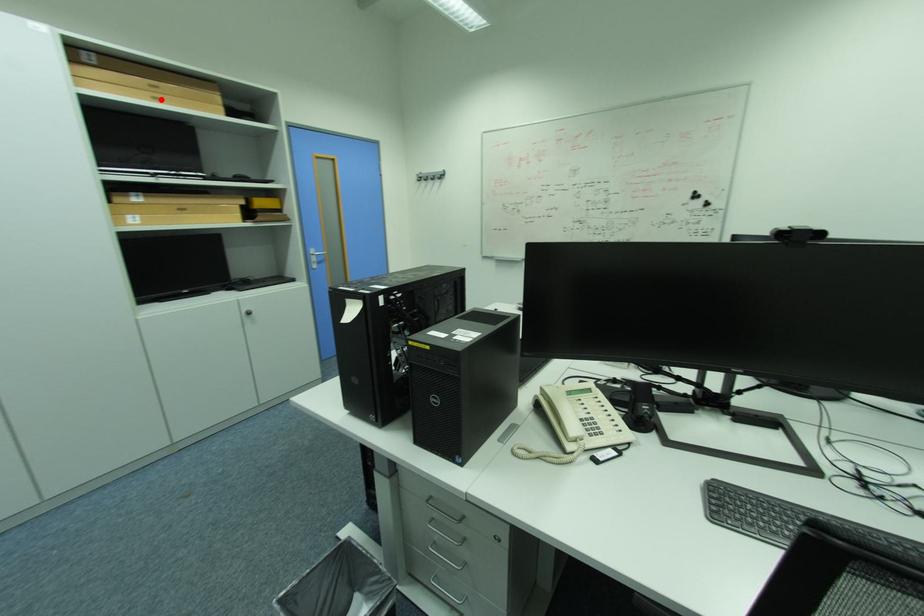
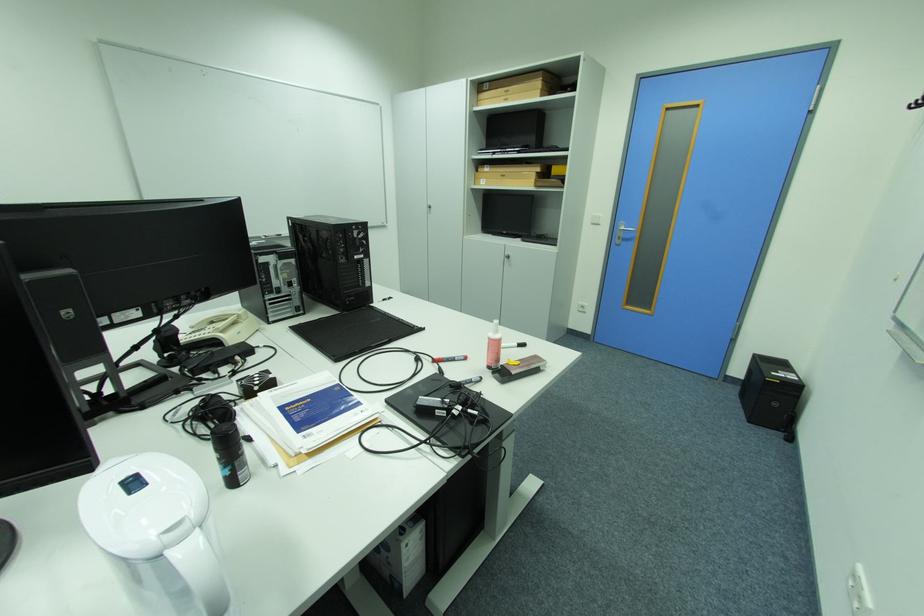
Question: I am providing you with two images of the same scene from different viewpoints. A red point is shown in image1. For the corresponding object point in image2, is it positioned nearer or farther from the camera?

Choices:
 (A) Nearer
 (B) Farther

Answer: (A)